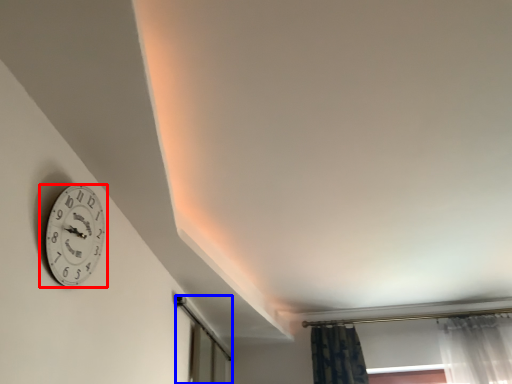
Question: Among these objects, which one is farthest to the camera, wall clock (highlighted by a red box) or glass door (highlighted by a blue box)?

Choices:
 (A) wall clock
 (B) glass door

Answer: (B)